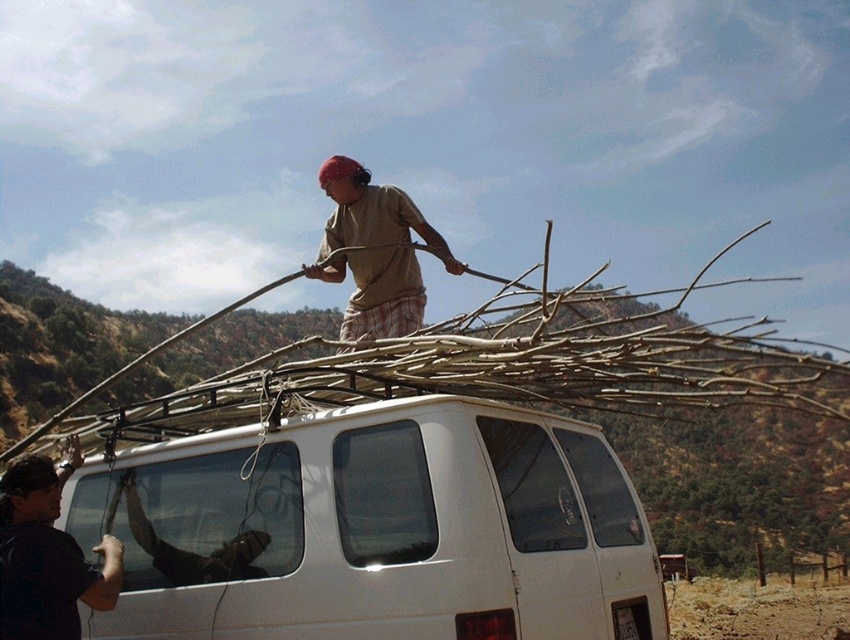
You are standing at the point marked by the coordinates (x=47, y=554) in the image. Looking around, you see the black fabric at left. Based on the scene description, what is the nearest object to you?

The nearest object to you at point (x=47, y=554) is the black fabric at left.

You are a delivery driver who needs to ensure the brown dry wood at upper center is securely tied to the white matte van at center. Given that the van is narrower, will the wood extend beyond the van on both sides when tied down?

The white matte van at center has a lesser width compared to brown dry wood at upper center, so when tied down, the wood will extend beyond the van on both sides due to its greater width.

Based on the scene description, can you determine the relative positions of the white matte van at center and the brown dry wood at upper center?

The white matte van at center is located to the left of the brown dry wood at upper center.